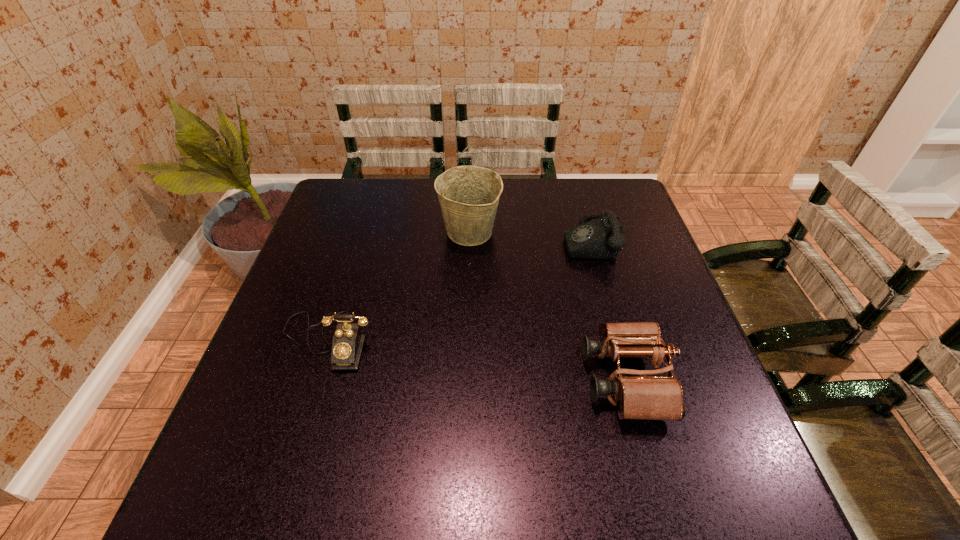
At what (x,y) coordinates should I click in order to perform the action: click on vacant region at the far edge of the desktop. Please return your answer as a coordinate pair (x, y). The height and width of the screenshot is (540, 960). Looking at the image, I should click on (389, 185).

Locate an element on the screen. The height and width of the screenshot is (540, 960). free space at the near edge of the desktop is located at coordinates (419, 486).

Locate an element on the screen. Image resolution: width=960 pixels, height=540 pixels. free space at the left edge of the desktop is located at coordinates (310, 334).

The width and height of the screenshot is (960, 540). Identify the location of vacant space at the right edge of the desktop. (665, 272).

Locate an element on the screen. This screenshot has height=540, width=960. vacant space at the far right corner of the desktop is located at coordinates (590, 179).

Where is `empty space that is in between the third object from right to left and the leftmost object`? Image resolution: width=960 pixels, height=540 pixels. empty space that is in between the third object from right to left and the leftmost object is located at coordinates click(398, 286).

Image resolution: width=960 pixels, height=540 pixels. Identify the location of vacant area that lies between the right telephone and the left telephone. (458, 291).

Where is `empty space that is in between the right telephone and the second object from left to right`? The image size is (960, 540). empty space that is in between the right telephone and the second object from left to right is located at coordinates (529, 237).

Where is `vacant area between the binoculars and the second object from left to right`? The image size is (960, 540). vacant area between the binoculars and the second object from left to right is located at coordinates (547, 306).

What are the coordinates of `blank region between the third object from right to left and the farther telephone` in the screenshot? It's located at (529, 237).